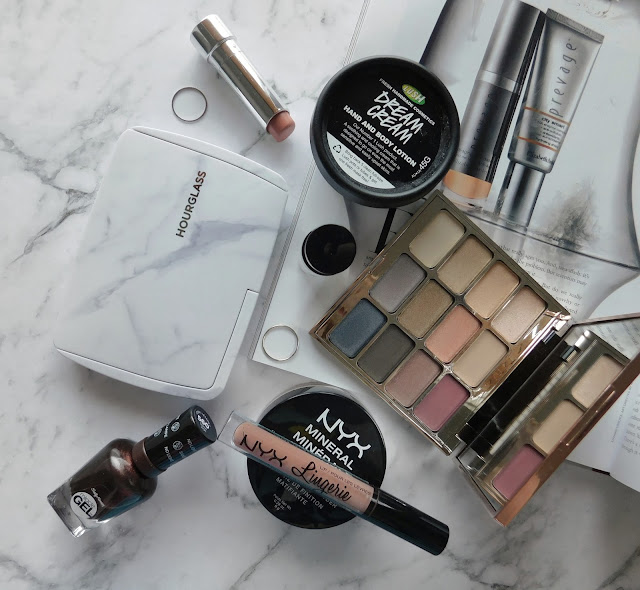
This screenshot has height=590, width=640. Identify the location of silver bottle of fountation. (539, 149).